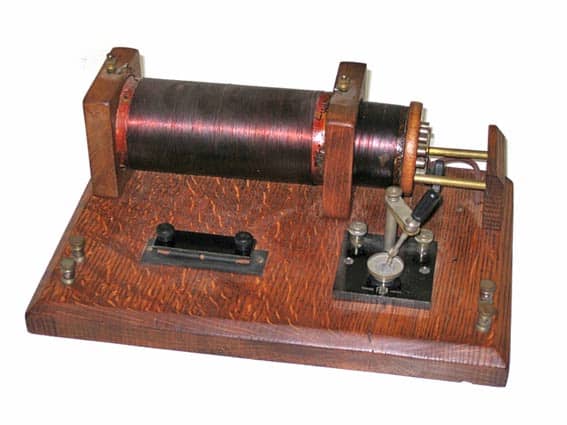
Locate an element on the screen. The width and height of the screenshot is (567, 425). wooden square block is located at coordinates (104, 118), (346, 133).